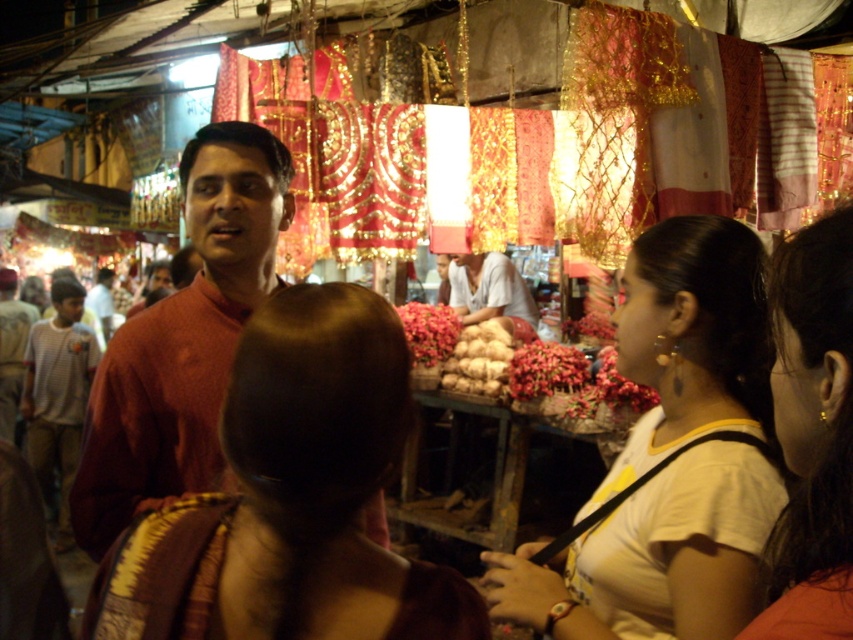
You are standing at the market and see two points in the scene. The first point is at coordinates point [757,252] and the second is at point [447,275]. Which point is closer to you?

Point [757,252] is in front of point [447,275], so it is closer to you.

You are a customer at the market and want to examine both the white matte shirt at center and the white fabric hair at upper right. Which item can you reach first if you walk straight ahead?

You can reach the white matte shirt at center first because it is closer to you than the white fabric hair at upper right.